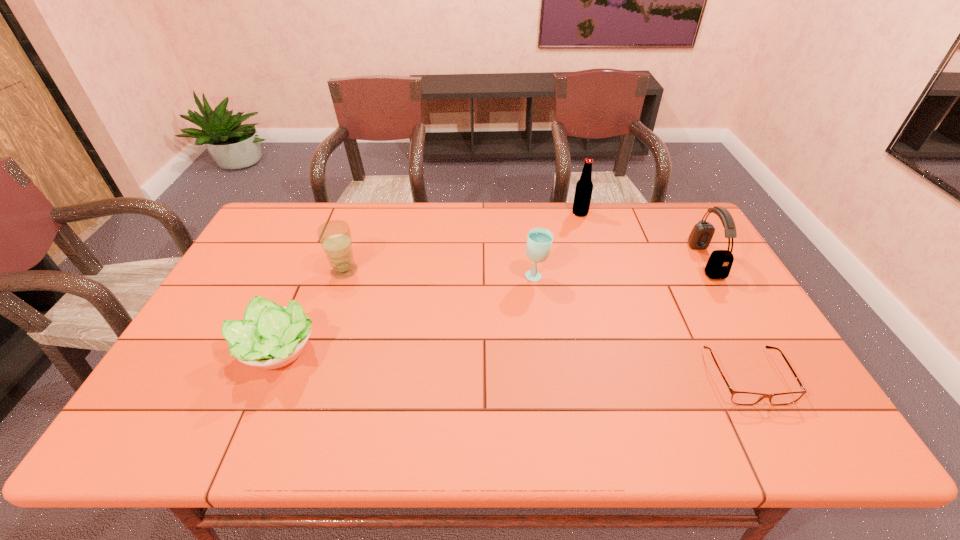
Identify the location of free space between the fourth object from right to left and the left glass. This screenshot has height=540, width=960. (440, 274).

Locate an element on the screen. free point between the fifth tallest object and the headset is located at coordinates (491, 306).

Find the location of a particular element. vacant region between the shortest object and the headset is located at coordinates (726, 319).

Where is `free spot between the lettuce and the left glass`? This screenshot has width=960, height=540. free spot between the lettuce and the left glass is located at coordinates (310, 312).

Locate which object is the third closest to the headset. Please provide its 2D coordinates. Your answer should be formatted as a tuple, i.e. [(x, y)], where the tuple contains the x and y coordinates of a point satisfying the conditions above.

[(539, 240)]

Select which object is the closest to the headset. Please provide its 2D coordinates. Your answer should be formatted as a tuple, i.e. [(x, y)], where the tuple contains the x and y coordinates of a point satisfying the conditions above.

[(738, 397)]

Find the location of `free space that satisfies the following two spatial constraints: 1. on the headband of the headset; 2. on the lenses of the spectacles`. free space that satisfies the following two spatial constraints: 1. on the headband of the headset; 2. on the lenses of the spectacles is located at coordinates (774, 376).

Where is `vacant region that satisfies the following two spatial constraints: 1. on the headband of the headset; 2. on the lenses of the spectacles`? The width and height of the screenshot is (960, 540). vacant region that satisfies the following two spatial constraints: 1. on the headband of the headset; 2. on the lenses of the spectacles is located at coordinates (774, 376).